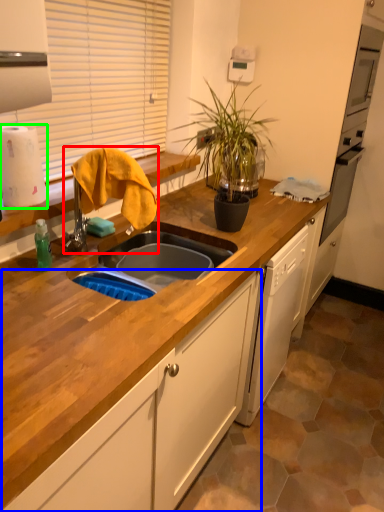
Question: Estimate the real-world distances between objects in this image. Which object is closer to faucet (highlighted by a red box), cabinetry (highlighted by a blue box) or paper towel (highlighted by a green box)?

Choices:
 (A) cabinetry
 (B) paper towel

Answer: (B)